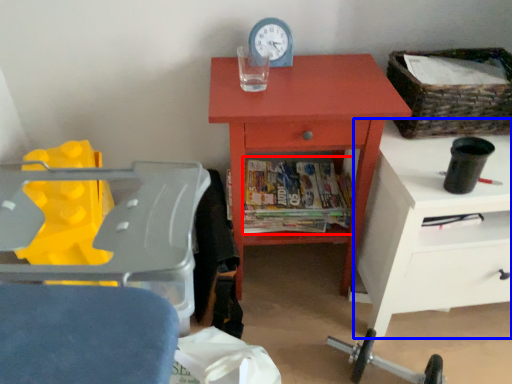
Question: Which object is closer to the camera taking this photo, magazine (highlighted by a red box) or nightstand (highlighted by a blue box)?

Choices:
 (A) magazine
 (B) nightstand

Answer: (B)